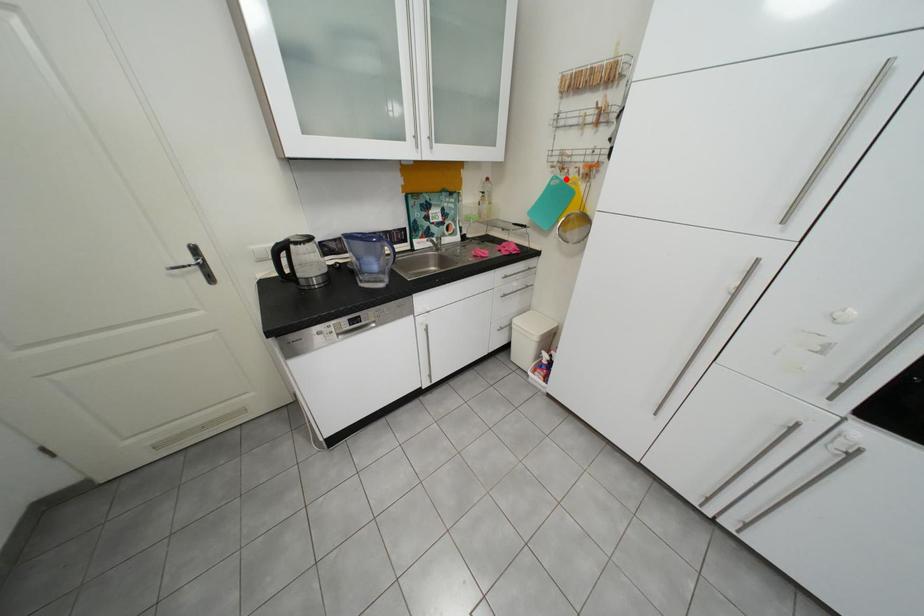
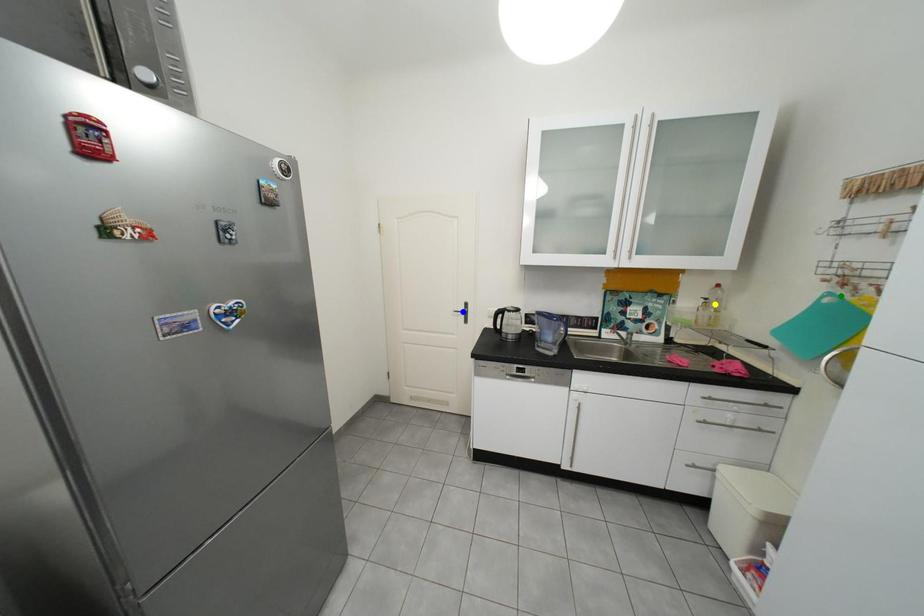
Question: I am providing you with two images of the same scene from different viewpoints. A red point is marked on the first image. You are given multiple points on the second image. In image 2, which mark is for the same physical point as the one in image 1?

Choices:
 (A) green point
 (B) blue point
 (C) yellow point

Answer: (A)